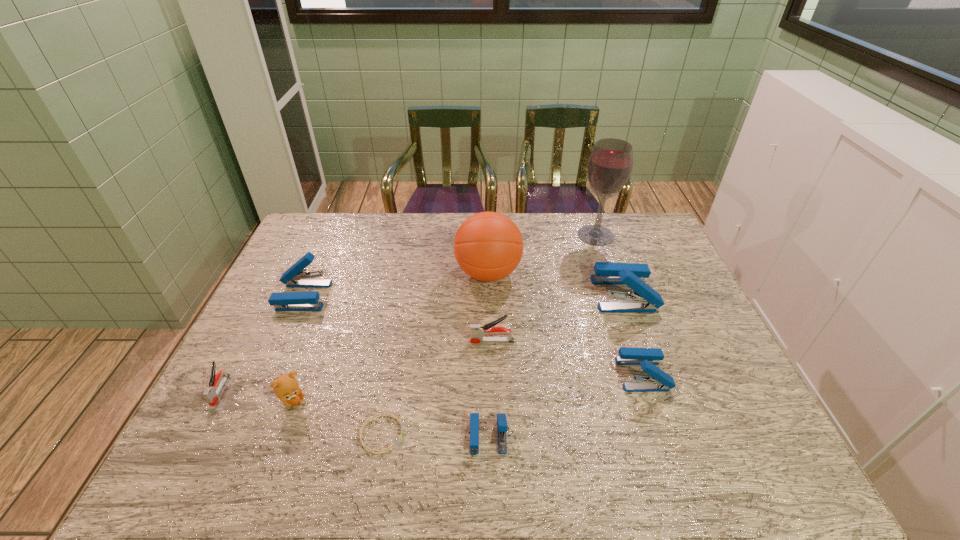
This screenshot has width=960, height=540. I want to click on object located in the far edge section of the desktop, so click(x=610, y=164).

The image size is (960, 540). I want to click on stapler that is at the near edge, so click(x=502, y=427).

This screenshot has width=960, height=540. I want to click on bracelet that is at the near edge, so click(x=381, y=414).

Image resolution: width=960 pixels, height=540 pixels. What are the coordinates of `object located in the right edge section of the desktop` in the screenshot? It's located at (644, 299).

You are a GUI agent. You are given a task and a screenshot of the screen. Output one action in this format:
    pyautogui.click(x=<x>, y=<y>)
    Task: Click on the vacant position at the far edge of the desktop
    
    Given the screenshot: What is the action you would take?
    pyautogui.click(x=580, y=248)

In the image, there is a desktop. What are the coordinates of `vacant space at the near edge` in the screenshot? It's located at (466, 464).

Where is `free spot at the right edge of the desktop`? The image size is (960, 540). free spot at the right edge of the desktop is located at coordinates (701, 319).

Find the location of a particular element. Image resolution: width=960 pixels, height=540 pixels. empty space that is in between the leftmost stapler and the shortest object is located at coordinates (300, 412).

You are a GUI agent. You are given a task and a screenshot of the screen. Output one action in this format:
    pyautogui.click(x=<x>, y=<y>)
    Task: Click on the empty location between the tallest stapler and the leftmost object
    The height and width of the screenshot is (540, 960).
    Given the screenshot: What is the action you would take?
    pyautogui.click(x=422, y=342)

The height and width of the screenshot is (540, 960). Identify the location of vacant area that lies between the nearer gray stapler and the nearest stapler. (354, 413).